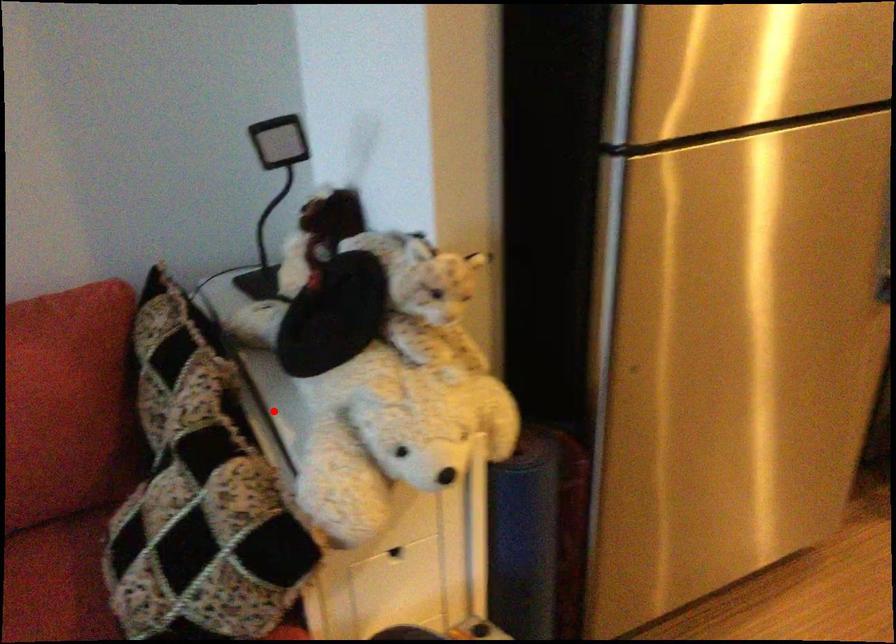
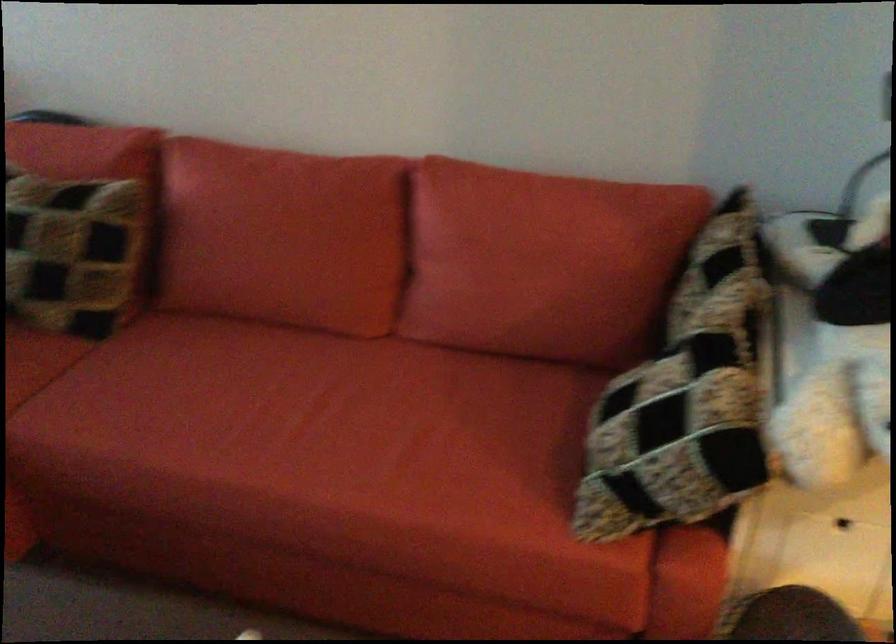
Find the pixel in the second image that matches the highlighted location in the first image.

(787, 341)